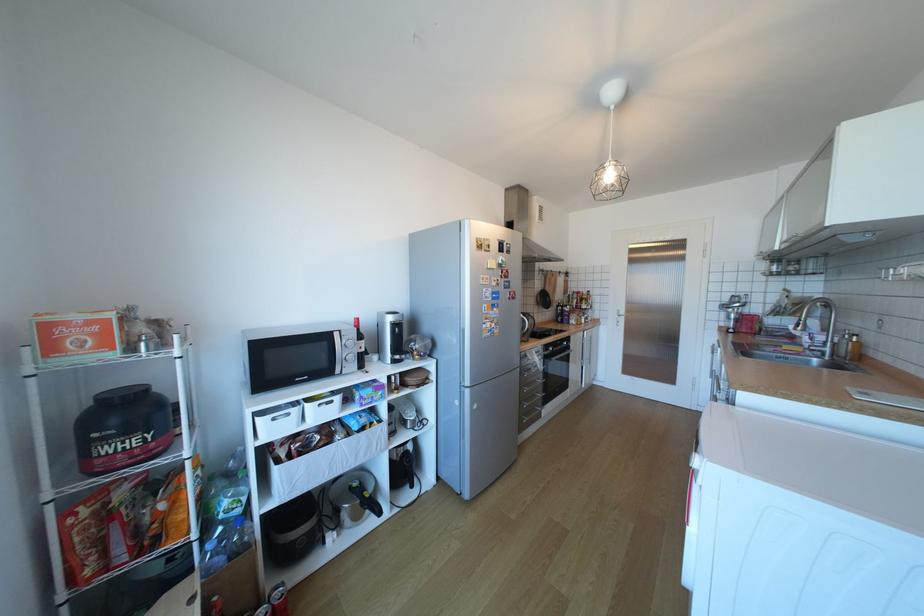
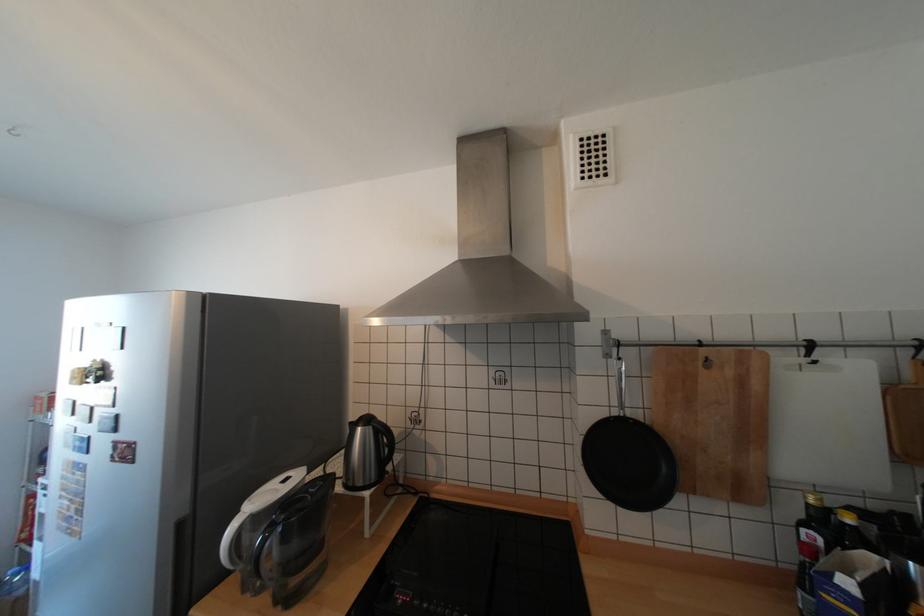
The point at (564,278) is marked in the first image. Where is the corresponding point in the second image?

(738, 371)